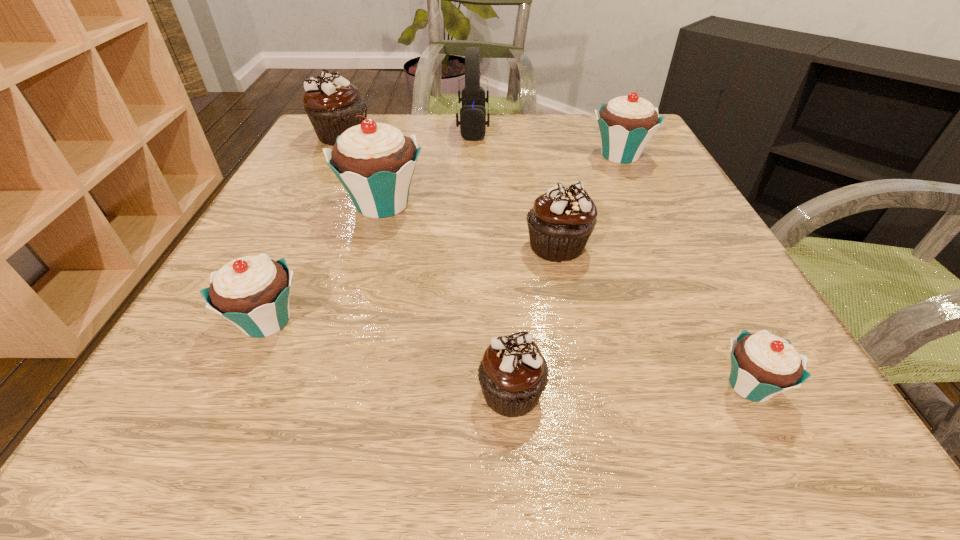
Identify the location of cupcake that is the fourth nearest to the nearest brown cupcake. (375, 162).

Locate an element on the screen. teal cupcake that is the fourth closest to the leftmost brown cupcake is located at coordinates (763, 365).

Choose which teal cupcake is the nearest neighbor to the smallest teal cupcake. Please provide its 2D coordinates. Your answer should be formatted as a tuple, i.e. [(x, y)], where the tuple contains the x and y coordinates of a point satisfying the conditions above.

[(375, 162)]

You are a GUI agent. You are given a task and a screenshot of the screen. Output one action in this format:
    pyautogui.click(x=<x>, y=<y>)
    Task: Click on the brown cupcake identified as the second closest to the leftmost brown cupcake
    The height and width of the screenshot is (540, 960).
    Given the screenshot: What is the action you would take?
    pyautogui.click(x=513, y=373)

Find the location of a particular element. Image resolution: width=960 pixels, height=540 pixels. brown cupcake that is the third closest to the nearest teal cupcake is located at coordinates (331, 103).

Locate an element on the screen. blank area in the image that satisfies the following two spatial constraints: 1. on the headband of the headset; 2. on the back side of the farthest teal cupcake is located at coordinates (472, 156).

You are a GUI agent. You are given a task and a screenshot of the screen. Output one action in this format:
    pyautogui.click(x=<x>, y=<y>)
    Task: Click on the free space that satisfies the following two spatial constraints: 1. on the front side of the third nearest cupcake; 2. on the right side of the biggest brown cupcake
    This screenshot has width=960, height=540.
    Given the screenshot: What is the action you would take?
    pyautogui.click(x=249, y=321)

Where is `free spot that satisfies the following two spatial constraints: 1. on the front side of the third nearest teal cupcake; 2. on the left side of the smallest brown cupcake`? free spot that satisfies the following two spatial constraints: 1. on the front side of the third nearest teal cupcake; 2. on the left side of the smallest brown cupcake is located at coordinates (328, 392).

Locate an element on the screen. The image size is (960, 540). vacant space that satisfies the following two spatial constraints: 1. on the headband of the headset; 2. on the back side of the smallest brown cupcake is located at coordinates (467, 392).

In order to click on free location that satisfies the following two spatial constraints: 1. on the front side of the second smallest brown cupcake; 2. on the left side of the farthest brown cupcake in this screenshot , I will do `click(286, 246)`.